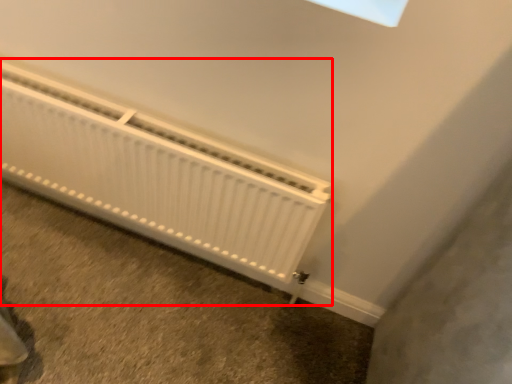
Question: From the image's perspective, what is the correct spatial positioning of radiator (annotated by the red box) in reference to concrete?

Choices:
 (A) below
 (B) above

Answer: (B)